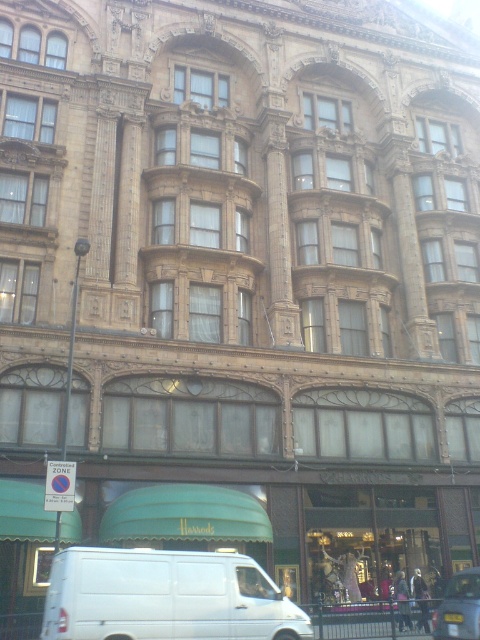
Question: Which object is closer to the camera taking this photo?

Choices:
 (A) white matte van at lower center
 (B) metallic silver car at lower right

Answer: (A)

Question: Which object is farther from the camera taking this photo?

Choices:
 (A) white matte van at lower center
 (B) metallic silver car at lower right

Answer: (B)

Question: Which point is farther to the camera?

Choices:
 (A) metallic silver car at lower right
 (B) white matte van at lower center

Answer: (A)

Question: Is white matte van at lower center positioned before metallic silver car at lower right?

Choices:
 (A) no
 (B) yes

Answer: (B)

Question: Is white matte van at lower center to the right of metallic silver car at lower right from the viewer's perspective?

Choices:
 (A) yes
 (B) no

Answer: (B)

Question: In this image, where is white matte van at lower center located relative to metallic silver car at lower right?

Choices:
 (A) above
 (B) below

Answer: (A)